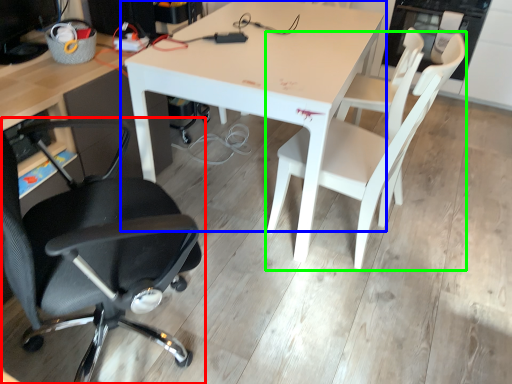
Question: Estimate the real-world distances between objects in this image. Which object is farther from chair (highlighted by a red box), table (highlighted by a blue box) or chair (highlighted by a green box)?

Choices:
 (A) table
 (B) chair

Answer: (B)